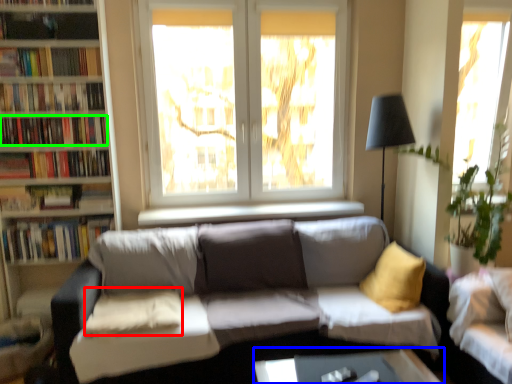
Question: Which is nearer to the pillow (highlighted by a red box)? table (highlighted by a blue box) or book (highlighted by a green box).

Choices:
 (A) table
 (B) book

Answer: (B)